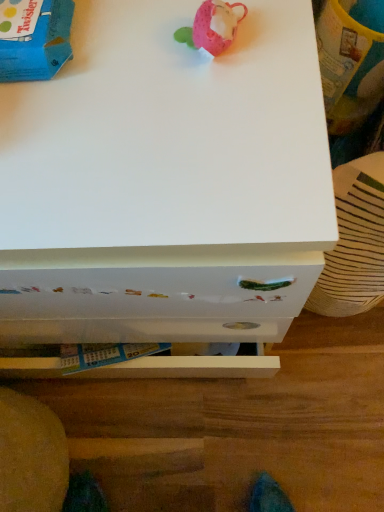
Where is `free space that is in between blue cardboard box at upper left, which is counted as the first toy, starting from the left, and pink fabric mouse at upper center, which is counted as the 1th toy, starting from the right`? Image resolution: width=384 pixels, height=512 pixels. free space that is in between blue cardboard box at upper left, which is counted as the first toy, starting from the left, and pink fabric mouse at upper center, which is counted as the 1th toy, starting from the right is located at coordinates (125, 50).